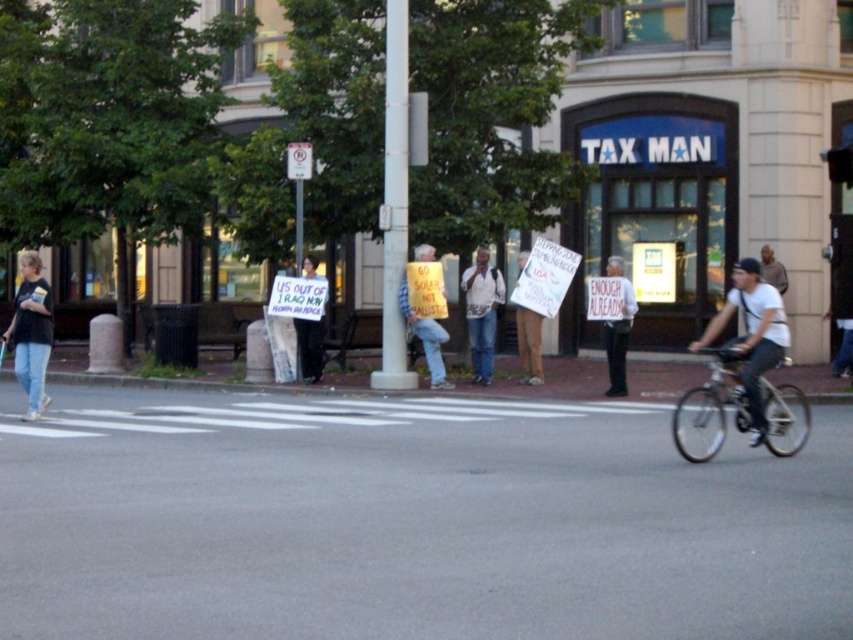
You are a photographer trying to capture a clear shot of the denim jeans at left and the white shirt at center. Considering their positions, which one is more likely to be in focus if you focus on the middle of the frame?

The white shirt at center is positioned at the center of the frame, so focusing on the middle would likely keep it in focus. The denim jeans at left, being off to the side, might be slightly out of focus depending on the camera settings.

You are a pedestrian trying to cross the street at the pedestrian crossing. There is a dark gray bicycle at center right and a white paper sign at center. Which object is closer to the left side of the crossing?

The white paper sign at center is closer to the left side of the crossing because the dark gray bicycle at center right is to the right of it.

Based on the scene description, where is the denim jeans at left located in terms of its 2D coordinates?

The denim jeans at left is located at the 2D coordinates point (32, 332).